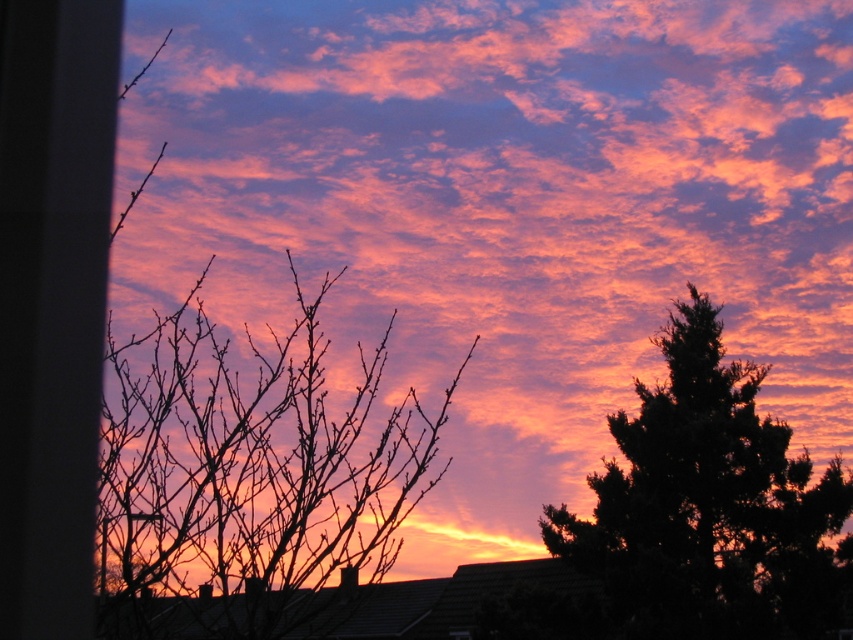
Who is positioned more to the right, silhouette branches at left or dark green textured tree at right?

Positioned to the right is dark green textured tree at right.

What do you see at coordinates (248, 481) in the screenshot?
I see `silhouette branches at left` at bounding box center [248, 481].

Locate an element on the screen. The height and width of the screenshot is (640, 853). silhouette branches at left is located at coordinates tap(248, 481).